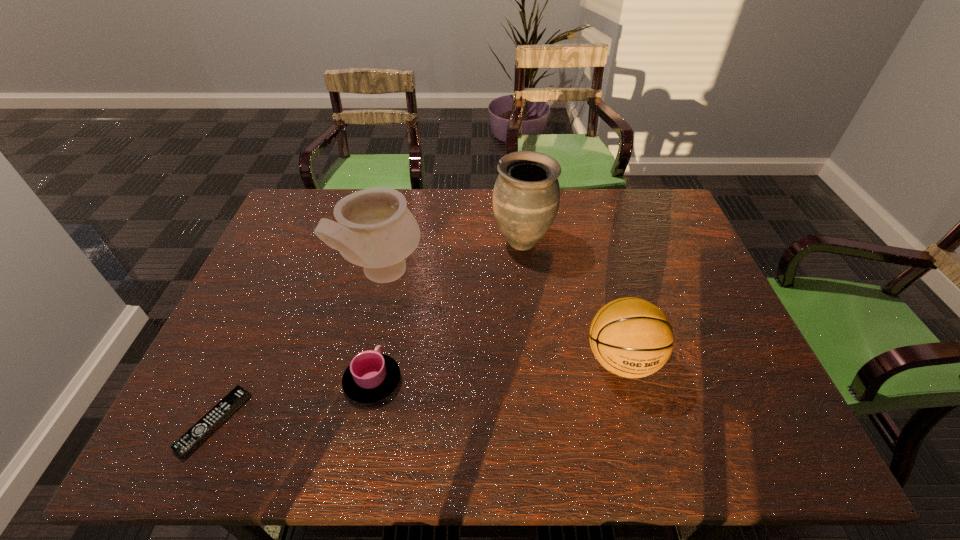
Locate an element on the screen. The width and height of the screenshot is (960, 540). unoccupied area between the remote control and the urn is located at coordinates (369, 332).

This screenshot has width=960, height=540. What are the coordinates of `vacant region between the rightmost object and the shortest object` in the screenshot? It's located at pyautogui.click(x=418, y=391).

Where is `object that is the closest to the second object from right to left`? This screenshot has width=960, height=540. object that is the closest to the second object from right to left is located at coordinates (375, 230).

Identify the location of object that stands as the third closest to the cup. This screenshot has width=960, height=540. (526, 195).

What are the coordinates of `free space that satisfies the following two spatial constraints: 1. on the back side of the second object from right to left; 2. on the left side of the pottery` in the screenshot? It's located at (390, 241).